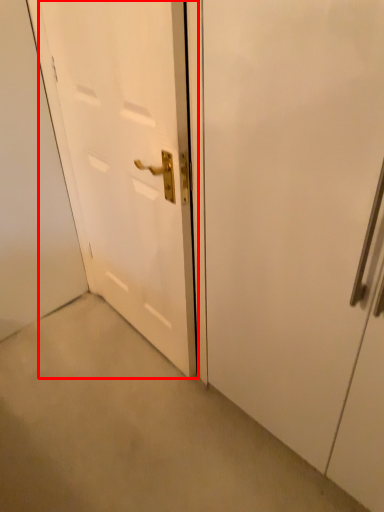
Question: Where is door (annotated by the red box) located in relation to door in the image?

Choices:
 (A) right
 (B) left

Answer: (B)